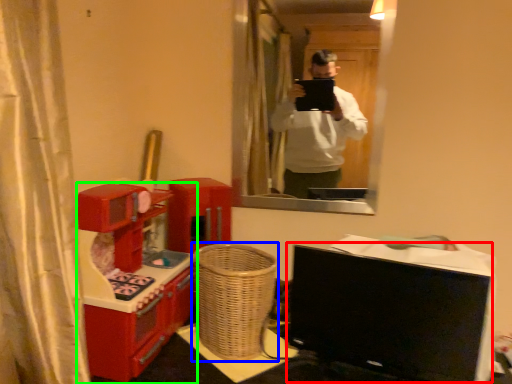
Question: Estimate the real-world distances between objects in this image. Which object is closer to computer monitor (highlighted by a red box), basket (highlighted by a blue box) or furniture (highlighted by a green box)?

Choices:
 (A) basket
 (B) furniture

Answer: (A)